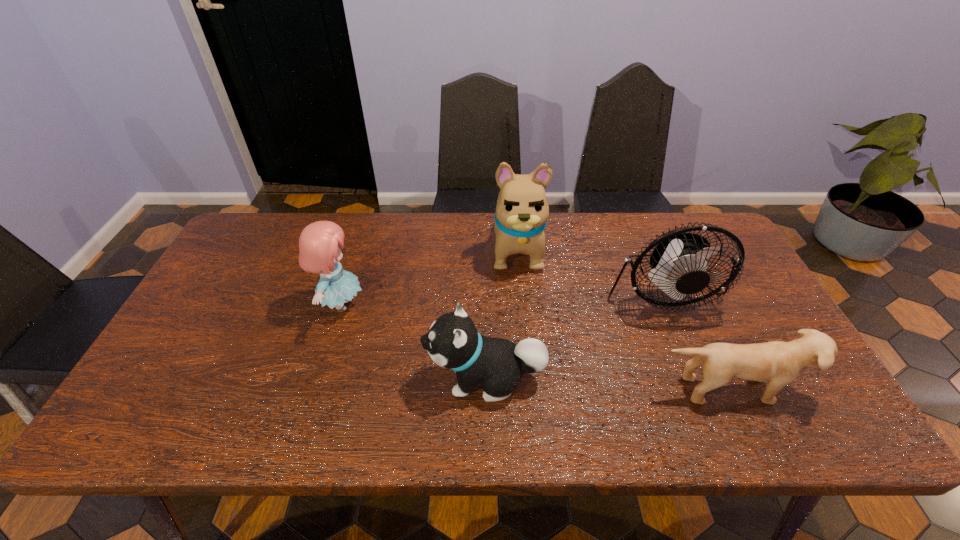
Where is `fan present at the right edge`? This screenshot has height=540, width=960. fan present at the right edge is located at coordinates (679, 263).

Image resolution: width=960 pixels, height=540 pixels. I want to click on puppy located at the right edge, so click(781, 362).

Where is `object present at the near right corner`? object present at the near right corner is located at coordinates (781, 362).

The width and height of the screenshot is (960, 540). In the image, there is a desktop. What are the coordinates of `vacant space at the far edge` in the screenshot? It's located at (441, 215).

I want to click on vacant space at the near edge, so click(x=425, y=413).

In the image, there is a desktop. At what (x,y) coordinates should I click in order to perform the action: click on vacant area at the left edge. Please return your answer as a coordinate pair (x, y). This screenshot has width=960, height=540. Looking at the image, I should click on (262, 274).

In order to click on vacant space at the far right corner of the desktop in this screenshot , I will do `click(674, 217)`.

At what (x,y) coordinates should I click in order to perform the action: click on vacant area at the near right corner. Please return your answer as a coordinate pair (x, y). This screenshot has width=960, height=540. Looking at the image, I should click on (835, 437).

This screenshot has width=960, height=540. I want to click on free area in between the fan and the tallest puppy, so click(x=589, y=270).

The height and width of the screenshot is (540, 960). I want to click on free area in between the rightmost puppy and the farthest puppy, so click(x=623, y=319).